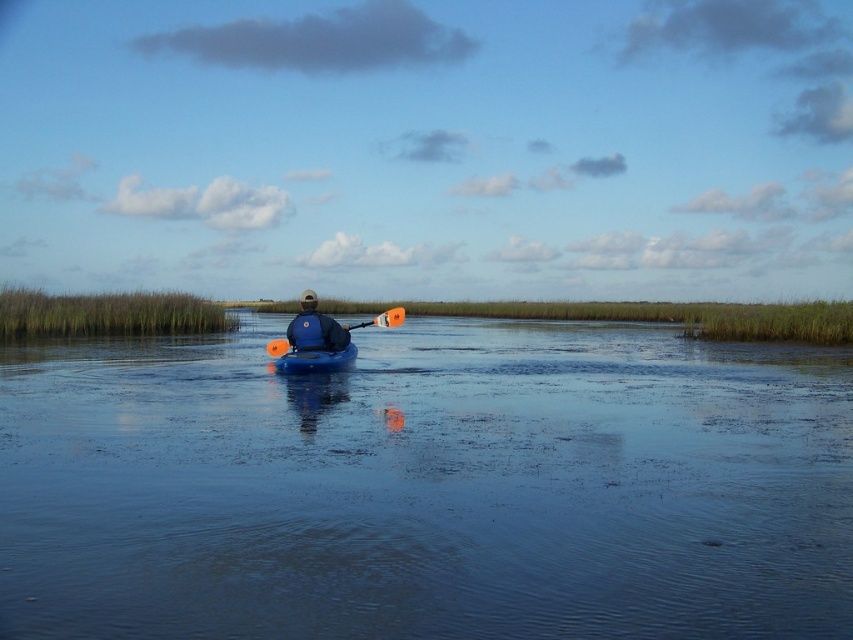
Question: Does blue plastic kayak at center have a larger size compared to orange paddle at center?

Choices:
 (A) yes
 (B) no

Answer: (A)

Question: Does blue plastic kayak at center appear under orange paddle at center?

Choices:
 (A) yes
 (B) no

Answer: (A)

Question: Which point is closer to the camera?

Choices:
 (A) blue matte kayak at center
 (B) orange paddle at center
 (C) blue plastic kayak at center
 (D) blue plastic canoe at center

Answer: (C)

Question: Among these points, which one is nearest to the camera?

Choices:
 (A) (346, 356)
 (B) (270, 355)

Answer: (B)

Question: Can you confirm if blue plastic canoe at center is positioned to the left of orange paddle at center?

Choices:
 (A) no
 (B) yes

Answer: (B)

Question: Which point is farther from the camera taking this photo?

Choices:
 (A) (337, 326)
 (B) (363, 324)

Answer: (B)